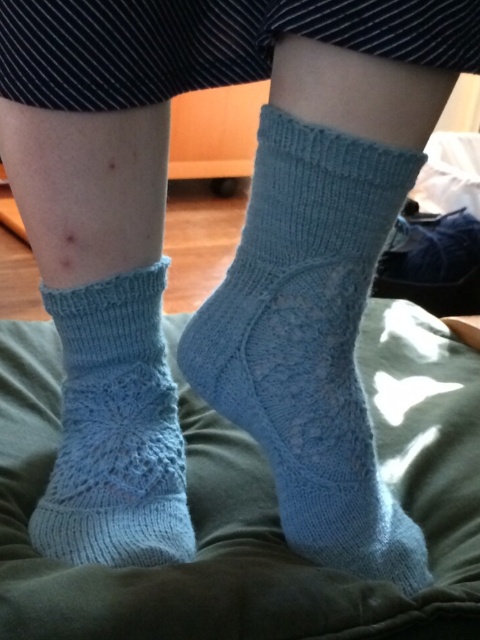
You are a fashion designer analyzing a photo of a person sitting on a green cushioned surface. You notice a point at coordinates (101,259). According to the image, what object is located at that point?

The point at coordinates (101,259) marks the light blue knitted socks at lower center.

You are a fashion designer examining two light blue knitted socks. You notice that one is labeled as light blue knitted socks at lower center and the other as light blue knitted sock at lower left. Which sock is bigger in size?

The light blue knitted socks at lower center is larger in size compared to the light blue knitted sock at lower left.